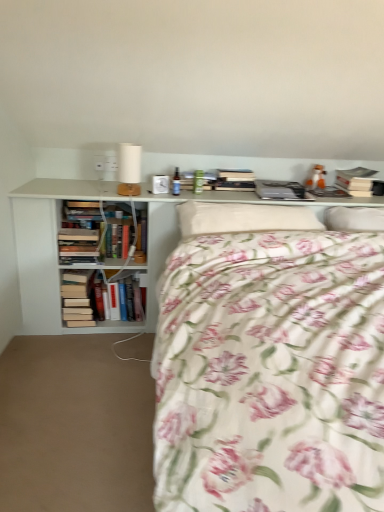
Question: Would you say hardcover book at upper right, the third book when ordered from bottom to top, is inside or outside floral cotton bed at center?

Choices:
 (A) inside
 (B) outside

Answer: (B)

Question: From a real-world perspective, is hardcover book at upper right, the first book in the top-to-bottom sequence, positioned above or below floral cotton bed at center?

Choices:
 (A) above
 (B) below

Answer: (A)

Question: Estimate the real-world distances between objects in this image. Which object is farther from the hardcover book at upper right, the first book in the top-to-bottom sequence?

Choices:
 (A) fluffy white pillow at center, placed as the 2th pillow when sorted from right to left
 (B) white matte bookcase at upper center
 (C) hardcover books at left, the 1th book in the bottom-to-top sequence
 (D) white matte table lamp at upper center
 (E) hardcover books at left, the 2th book in the left-to-right sequence

Answer: (C)

Question: Which object is positioned closest to the hardcover book at upper right, the third book when ordered from bottom to top?

Choices:
 (A) hardcover books at left, positioned as the 2th book in top-to-bottom order
 (B) white matte bookcase at upper center
 (C) hardcover books at left, which is the first book in left-to-right order
 (D) white matte table lamp at upper center
 (E) floral cotton bed at center

Answer: (B)